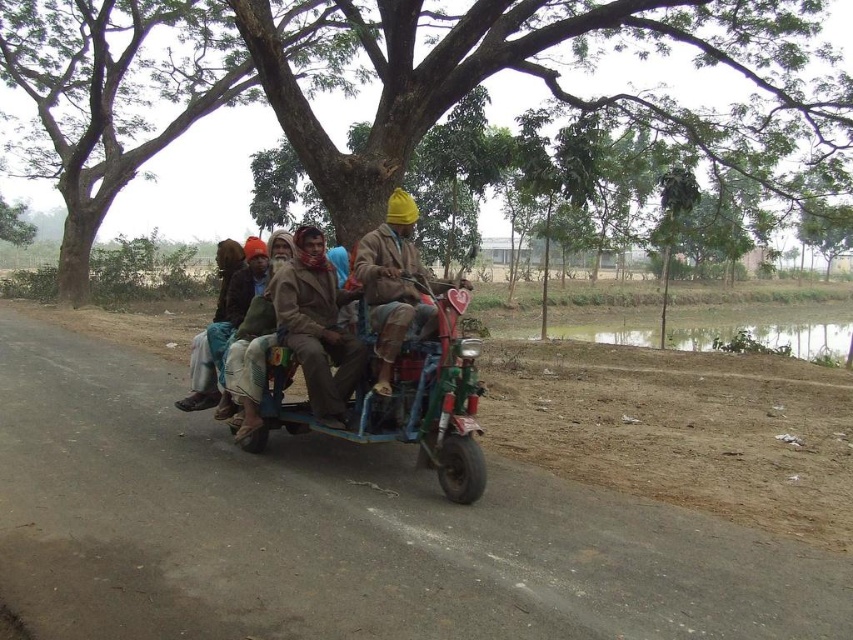
You are a photographer trying to capture the metallic green motorbike at center and the brown fabric jacket at center in the same frame. Given that your camera has a fixed focal length, which object should you position closer to the camera to ensure both fit in the frame?

Since the metallic green motorbike at center is wider than the brown fabric jacket at center, you should position the metallic green motorbike at center closer to the camera. This way, its larger size will be reduced in the frame, allowing both objects to fit within the camera view.

From the picture: You are a traveler who wants to take a photo of the green leafy tree at center and the brown fabric jacket at center from the road. Which object should you focus on first if you want to capture both in one frame?

The green leafy tree at center is located above the brown fabric jacket at center, so you should focus on the brown fabric jacket at center first to ensure both are in the frame.

You are a tourist visiting this rural area and want to take a photo of the green leafy tree at center and the matte brown jacket at center. Which object should you focus on first if you want to capture both in a single frame without moving the camera?

The green leafy tree at center is larger in size than the matte brown jacket at center, so you should focus on the green leafy tree at center first to ensure it fills the frame appropriately before adjusting for the smaller matte brown jacket at center.